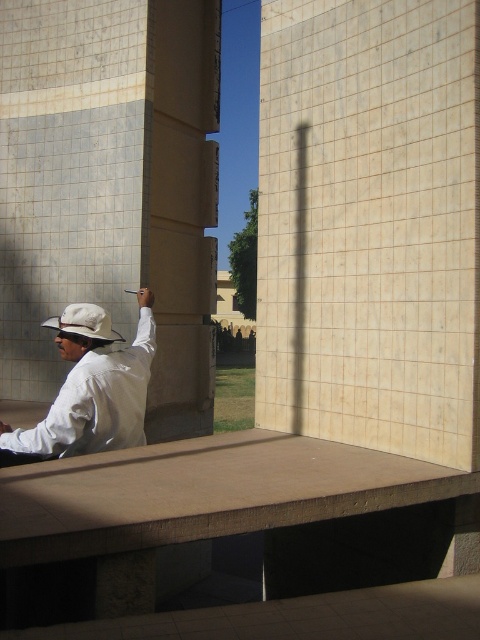
What do you see at coordinates (203, 492) in the screenshot? I see `smooth concrete ledge at center` at bounding box center [203, 492].

Is point (295, 493) closer to viewer compared to point (64, 410)?

Yes, point (295, 493) is closer to viewer.

The height and width of the screenshot is (640, 480). I want to click on smooth concrete ledge at center, so click(x=203, y=492).

Does white matte shirt at center come behind white matte hat at center?

No, white matte shirt at center is in front of white matte hat at center.

Who is higher up, white matte shirt at center or white matte hat at center?

Positioned higher is white matte hat at center.

Is point (122, 397) farther from viewer compared to point (69, 332)?

No, it is in front of (69, 332).

Where is `white matte shirt at center`? white matte shirt at center is located at coordinates (91, 388).

The width and height of the screenshot is (480, 640). What are the coordinates of `smooth concrete ledge at center` in the screenshot? It's located at (203, 492).

I want to click on smooth concrete ledge at center, so click(x=203, y=492).